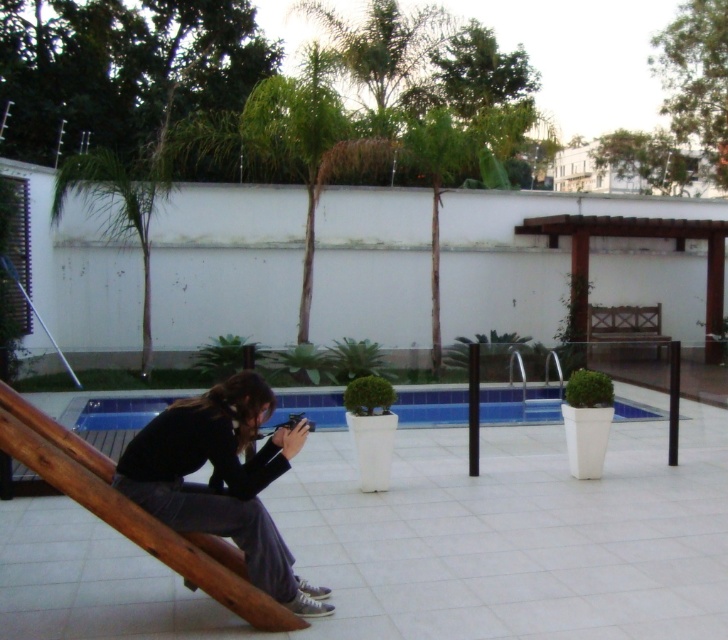
Looking at this image, you are a photographer standing at the point marked as point (221,480) in the image. You want to take a photo of the wooden handrail where the person is sitting. Is the matte black camera at lower left in your line of sight to the wooden handrail?

The point (221,480) corresponds to the matte black camera at lower left, so the camera is located at your current position. Therefore, you cannot see the wooden handrail through the camera because the camera itself is where you are standing.

You are standing at the center of the patio and want to take a photo of the swimming pool. The matte black camera at lower left is your only equipment. Can you reach the camera from your current position without moving your feet?

The matte black camera at lower left is located at point [221,480], which is within reach from the center of the patio. Yes, you can reach it without moving your feet.